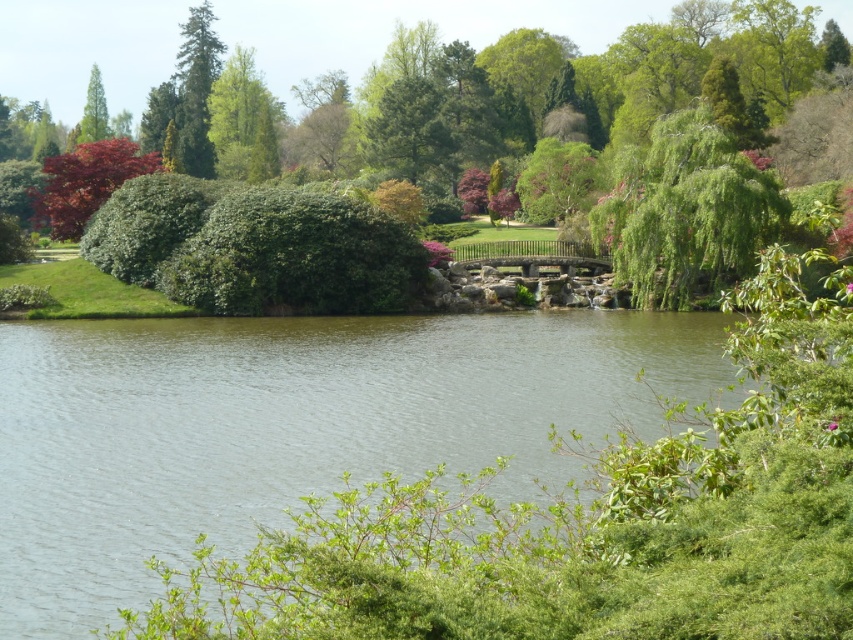
Image resolution: width=853 pixels, height=640 pixels. What do you see at coordinates (546, 88) in the screenshot? I see `green leafy bush at upper center` at bounding box center [546, 88].

The width and height of the screenshot is (853, 640). Describe the element at coordinates (546, 88) in the screenshot. I see `green leafy bush at upper center` at that location.

Locate an element on the screen. The image size is (853, 640). green leafy bush at upper center is located at coordinates (546, 88).

Is green smooth water at center further to the viewer compared to green textured tree at upper left?

No.

Consider the image. Can you confirm if green smooth water at center is positioned to the left of green textured tree at upper left?

No, green smooth water at center is not to the left of green textured tree at upper left.

At what (x,y) coordinates should I click in order to perform the action: click on green smooth water at center. Please return your answer as a coordinate pair (x, y). Looking at the image, I should click on (277, 426).

At what (x,y) coordinates should I click in order to perform the action: click on green smooth water at center. Please return your answer as a coordinate pair (x, y). Looking at the image, I should click on (277, 426).

From the picture: Is green leafy tree at upper left bigger than green textured tree at upper left?

No, green leafy tree at upper left is not bigger than green textured tree at upper left.

Is green leafy tree at upper left further to camera compared to green textured tree at upper left?

No.

The width and height of the screenshot is (853, 640). Describe the element at coordinates (242, 122) in the screenshot. I see `green leafy tree at upper left` at that location.

At what (x,y) coordinates should I click in order to perform the action: click on green leafy tree at upper left. Please return your answer as a coordinate pair (x, y). The image size is (853, 640). Looking at the image, I should click on (242, 122).